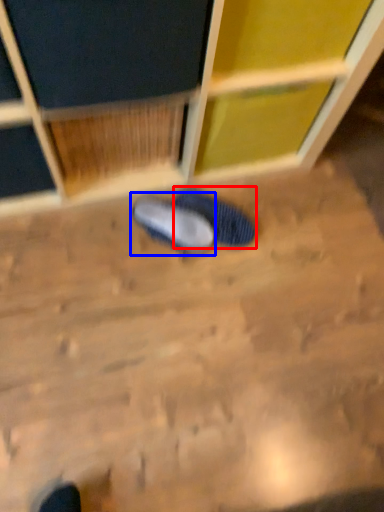
Question: Among these objects, which one is farthest to the camera, footwear (highlighted by a red box) or footwear (highlighted by a blue box)?

Choices:
 (A) footwear
 (B) footwear

Answer: (A)